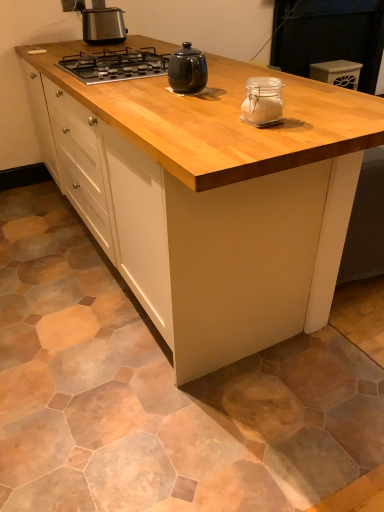
Question: From a real-world perspective, is black glass gas stove at upper center positioned above or below glossy ceramic mug at upper center, the second kitchen appliance in the top-to-bottom sequence?

Choices:
 (A) below
 (B) above

Answer: (A)

Question: From the image's perspective, is black glass gas stove at upper center positioned above or below glossy ceramic mug at upper center, which ranks as the second kitchen appliance in bottom-to-top order?

Choices:
 (A) above
 (B) below

Answer: (A)

Question: Considering the real-world distances, which object is closest to the white plastic container at upper right?

Choices:
 (A) glossy ceramic mug at upper center, the 2th kitchen appliance from the front
 (B) clear glass jar at center, which ranks as the third kitchen appliance in top-to-bottom order
 (C) black glass gas stove at upper center
 (D) satin black toaster at upper left, marked as the 3th kitchen appliance in a bottom-to-top arrangement
 (E) natural wood cabinet at center

Answer: (D)

Question: Estimate the real-world distances between objects in this image. Which object is closer to the clear glass jar at center, which is the first kitchen appliance from front to back?

Choices:
 (A) white plastic container at upper right
 (B) natural wood cabinet at center
 (C) satin black toaster at upper left, the third kitchen appliance positioned from the front
 (D) black glass gas stove at upper center
 (E) glossy ceramic mug at upper center, the second kitchen appliance in the top-to-bottom sequence

Answer: (E)